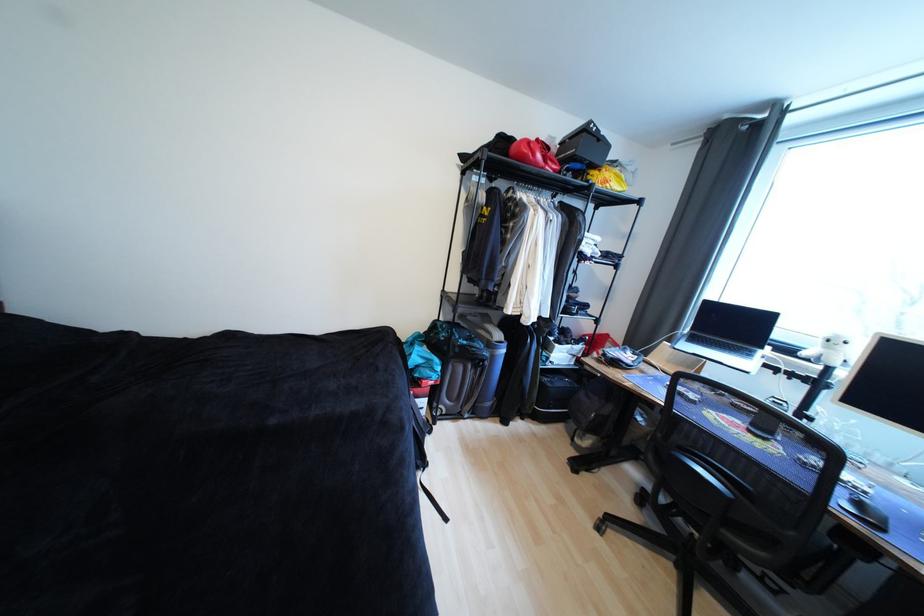
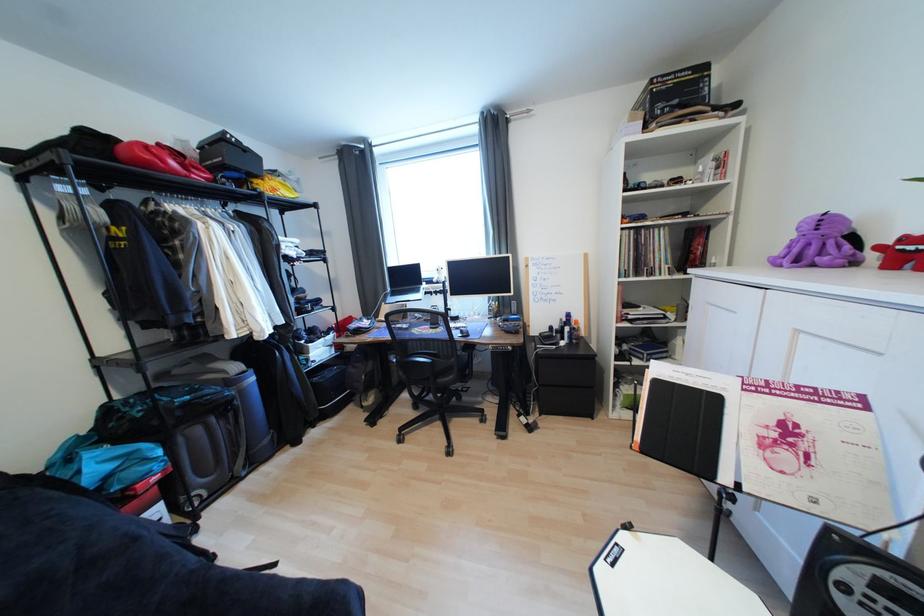
Question: The images are taken continuously from a first-person perspective. In which direction is your viewpoint rotating?

Choices:
 (A) Left
 (B) Right
 (C) Up
 (D) Down

Answer: (B)